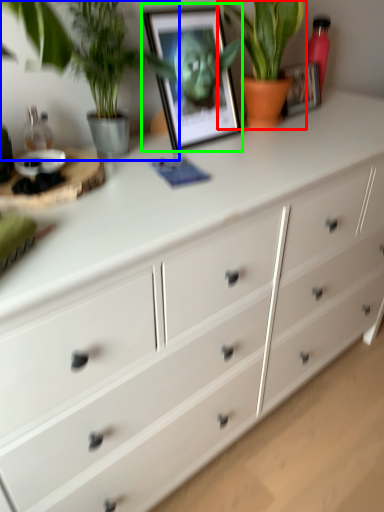
Question: Considering the real-world distances, which object is farthest from houseplant (highlighted by a red box)? houseplant (highlighted by a blue box) or picture frame (highlighted by a green box)?

Choices:
 (A) houseplant
 (B) picture frame

Answer: (A)